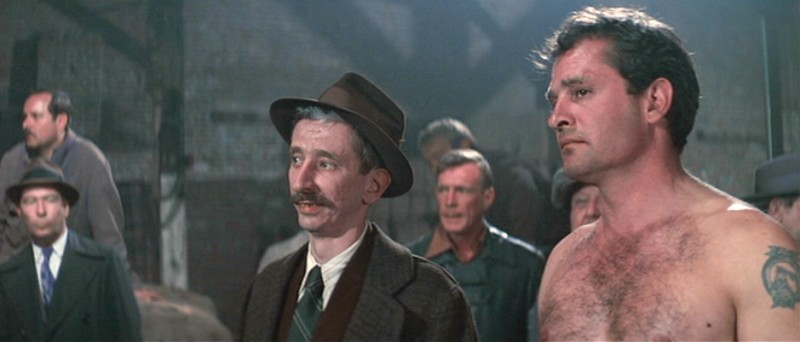
This screenshot has width=800, height=342. In order to click on wall in this screenshot , I will do `click(721, 96)`.